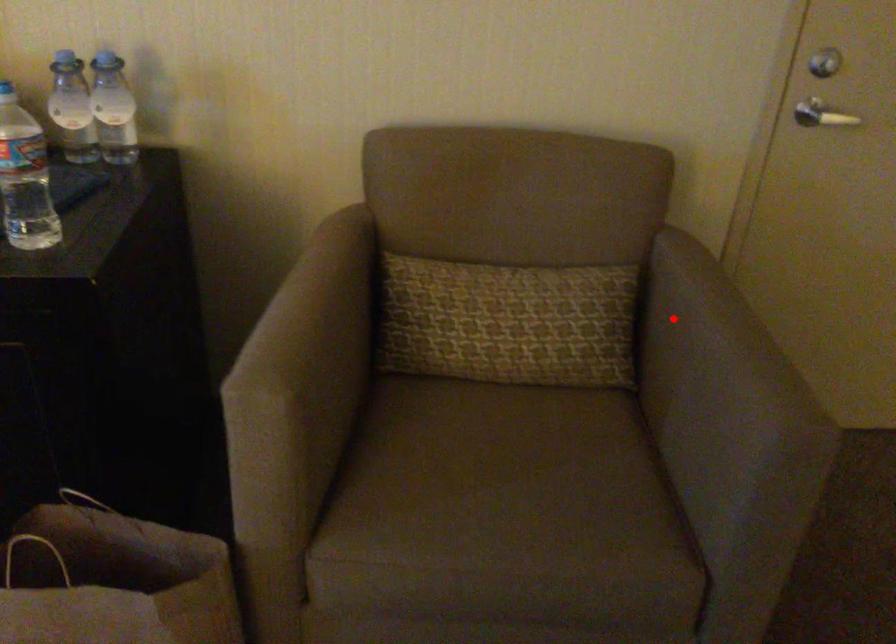
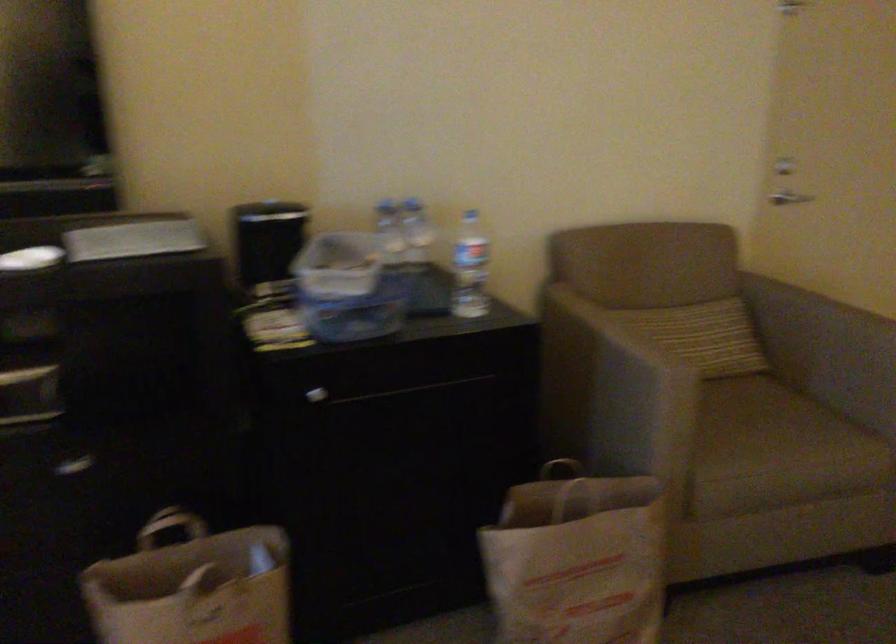
In the second image, find the point that corresponds to the highlighted location in the first image.

(807, 308)